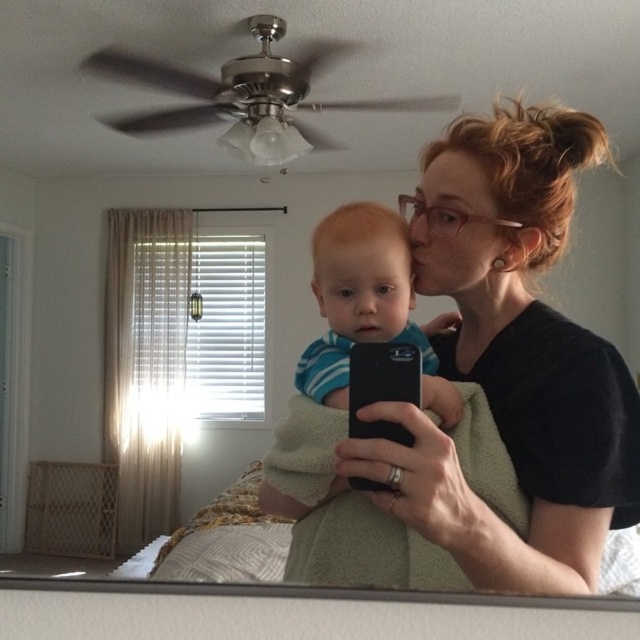
You are a photographer trying to capture a candid shot of the baby in the scene. You notice the black matte smartphone at center and the smooth blue striped shirt at center. Which object is closer to the camera?

The smooth blue striped shirt at center is closer to the camera because the black matte smartphone at center is behind it.

You are standing in the bedroom and want to place a small decorative item on one of the two points marked in the scene. Which point, point 1 at coordinates (506, 141) or point 2 at (300, 364), is closer to you so that the item will be more visible?

Point 1 at coordinates (506, 141) is closer to the viewer, so placing the decorative item there would make it more visible.

You are a photographer trying to frame a shot of the smooth blue striped shirt at center and the black matte smartphone at center. Which object is wider?

The smooth blue striped shirt at center is wider than the black matte smartphone at center.